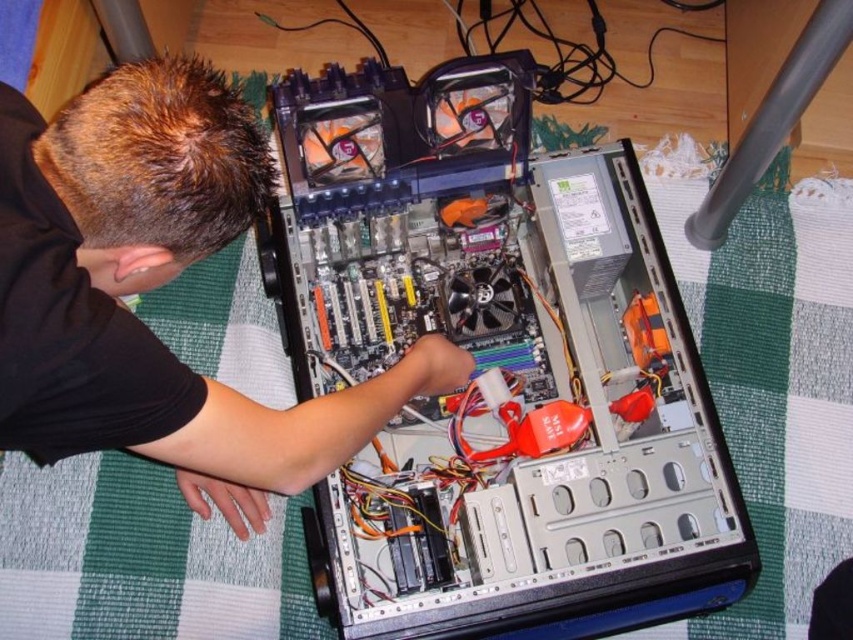
Question: Is silver metallic computer at center below black matte shirt at upper left?

Choices:
 (A) yes
 (B) no

Answer: (A)

Question: Which point is farther to the camera?

Choices:
 (A) black matte shirt at upper left
 (B) silver metallic computer at center

Answer: (B)

Question: Is silver metallic computer at center thinner than black matte shirt at upper left?

Choices:
 (A) no
 (B) yes

Answer: (A)

Question: Which point is farther to the camera?

Choices:
 (A) (486, 241)
 (B) (91, 228)

Answer: (A)

Question: Which point is closer to the camera?

Choices:
 (A) (495, 317)
 (B) (235, 461)

Answer: (B)

Question: Can you confirm if silver metallic computer at center is smaller than black matte shirt at upper left?

Choices:
 (A) no
 (B) yes

Answer: (A)